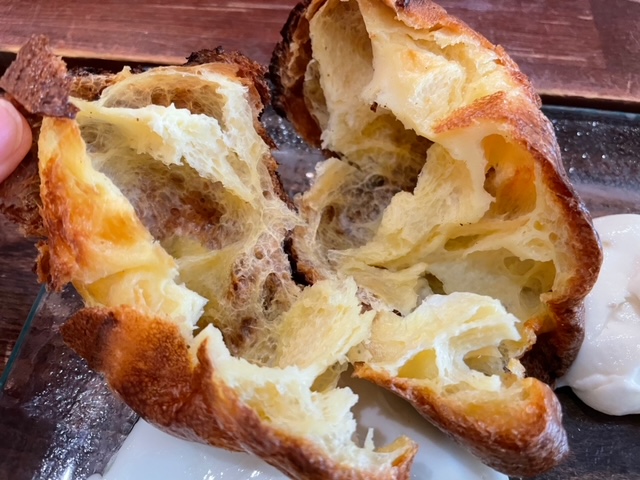
You are a GUI agent. You are given a task and a screenshot of the screen. Output one action in this format:
    pyautogui.click(x=<x>, y=<y>)
    Task: Click on the glass surface
    
    Given the screenshot: What is the action you would take?
    pyautogui.click(x=29, y=455), pyautogui.click(x=54, y=462), pyautogui.click(x=610, y=155), pyautogui.click(x=596, y=464)